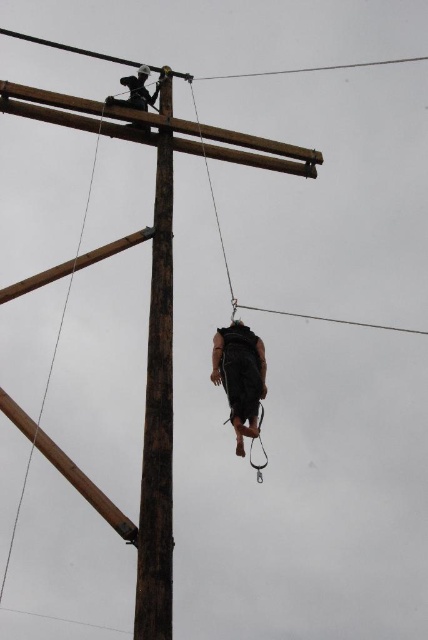
You are a safety inspector assessing the scene. You need to ensure that all workers are within the 50 meter safety zone. Is the black matte vest at center within the safety zone?

The black matte vest at center is 55.05 meters from the camera, which exceeds the 50 meter safety zone. Therefore, the worker wearing the black matte vest at center is outside the safety zone.

From the picture: You are a safety inspector assessing the utility pole setup. You notice the black matte vest at center and the smooth wire at upper center. According to safety protocols, the vest should be placed to the left of the wire to avoid interference. Is the current arrangement compliant with safety standards?

The black matte vest at center is positioned on the right side of the smooth wire at upper center, which means it is not placed to the left of the wire as required by safety protocols. Therefore, the current arrangement does not comply with safety standards.

You are a safety inspector assessing the scene. You notice the smooth wooden telegraph pole at center and the black matte vest at center. According to safety protocols, the pole should be positioned away from the vest to prevent entanglement. Is the current arrangement compliant with safety standards?

The smooth wooden telegraph pole at center is positioned over the black matte vest at center, which violates safety protocols as the pole should be positioned away from the vest to prevent entanglement.